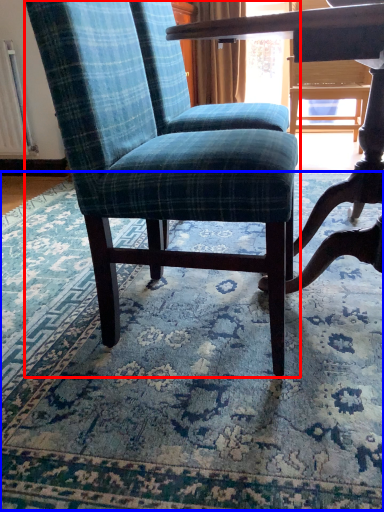
Question: Which of the following is the closest to the observer, chair (highlighted by a red box) or mat (highlighted by a blue box)?

Choices:
 (A) chair
 (B) mat

Answer: (B)